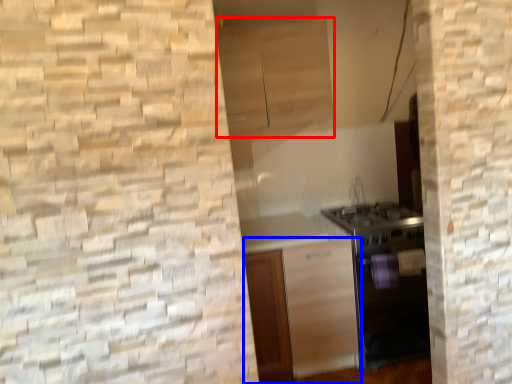
Question: Which point is further to the camera, cabinetry (highlighted by a red box) or cabinetry (highlighted by a blue box)?

Choices:
 (A) cabinetry
 (B) cabinetry

Answer: (A)